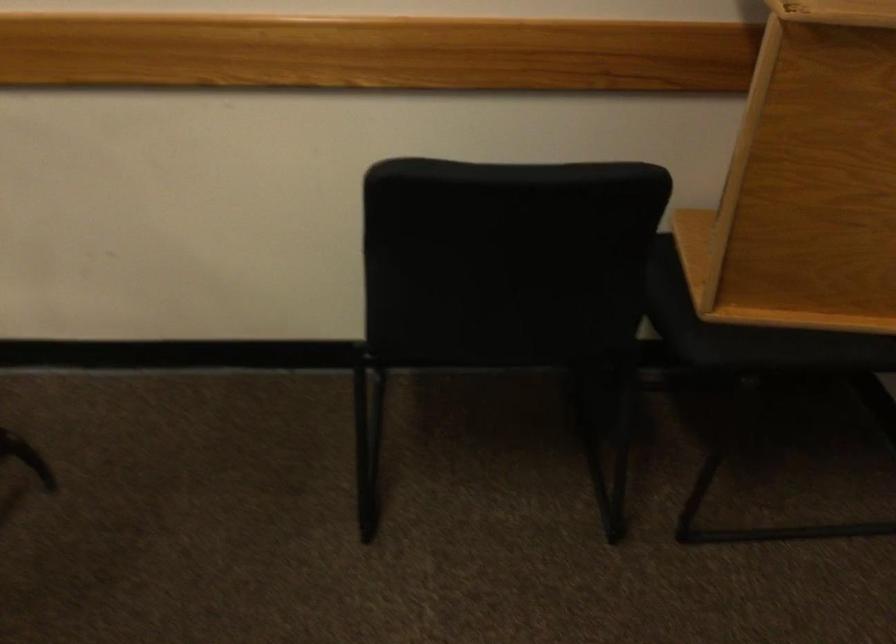
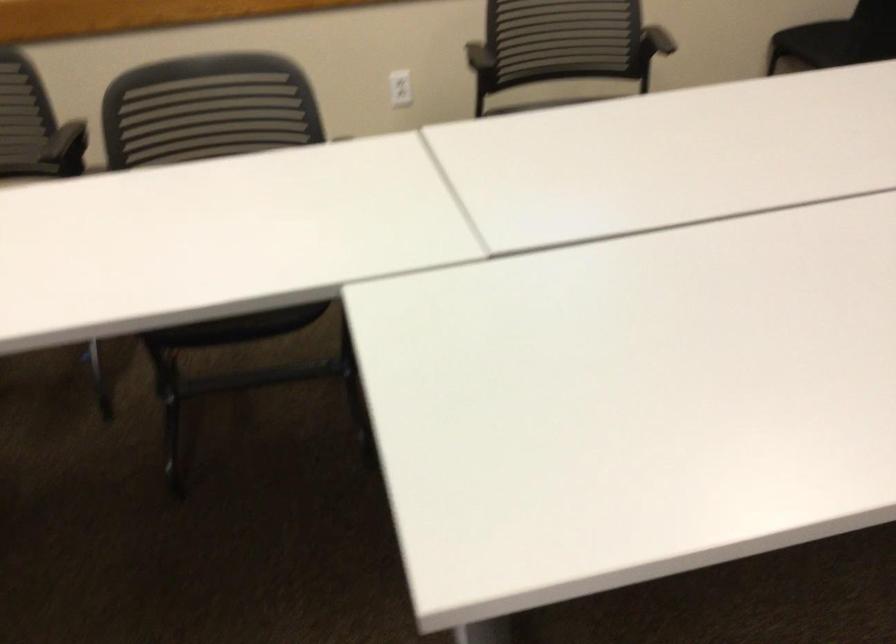
Find the pixel in the second image that matches the point at 182,211 in the first image.

(676, 43)